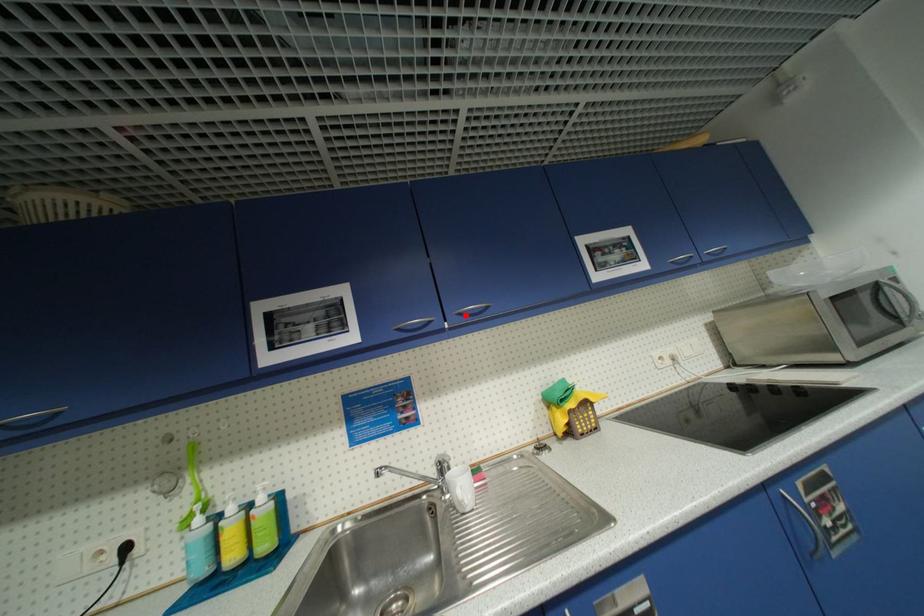
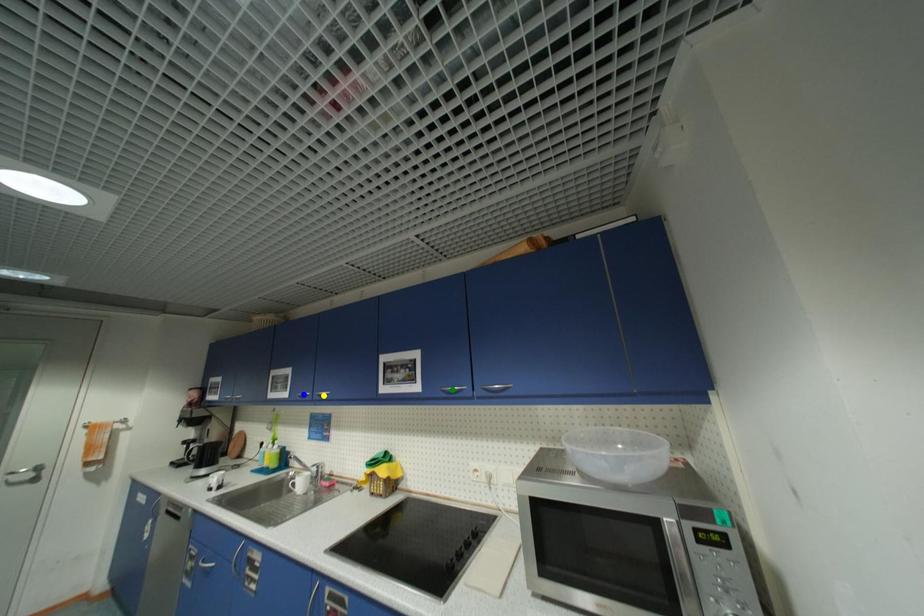
Question: I am providing you with two images of the same scene from different viewpoints. A red point is marked on the first image. You are given multiple points on the second image. Which mark in image 2 goes with the point in image 1?

Choices:
 (A) green point
 (B) yellow point
 (C) blue point

Answer: (B)